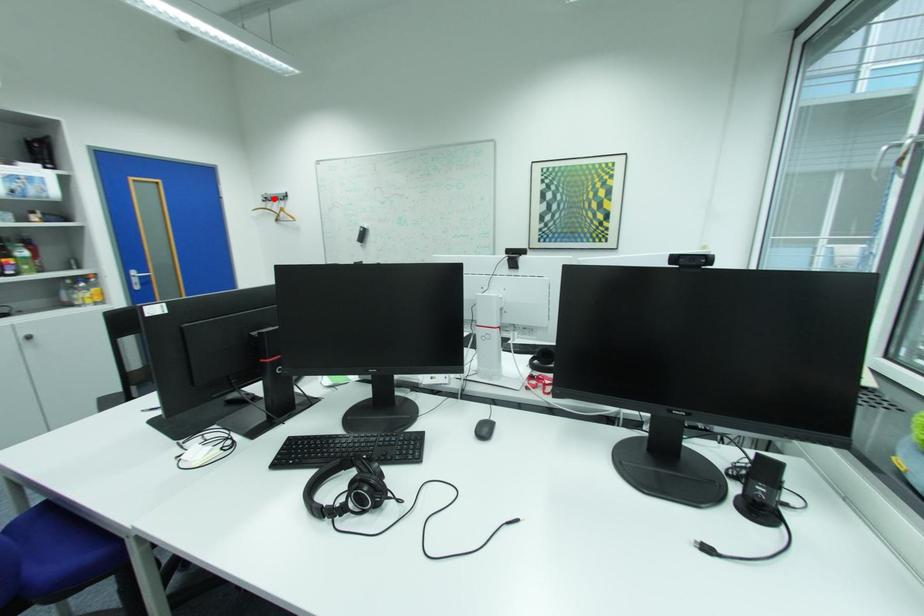
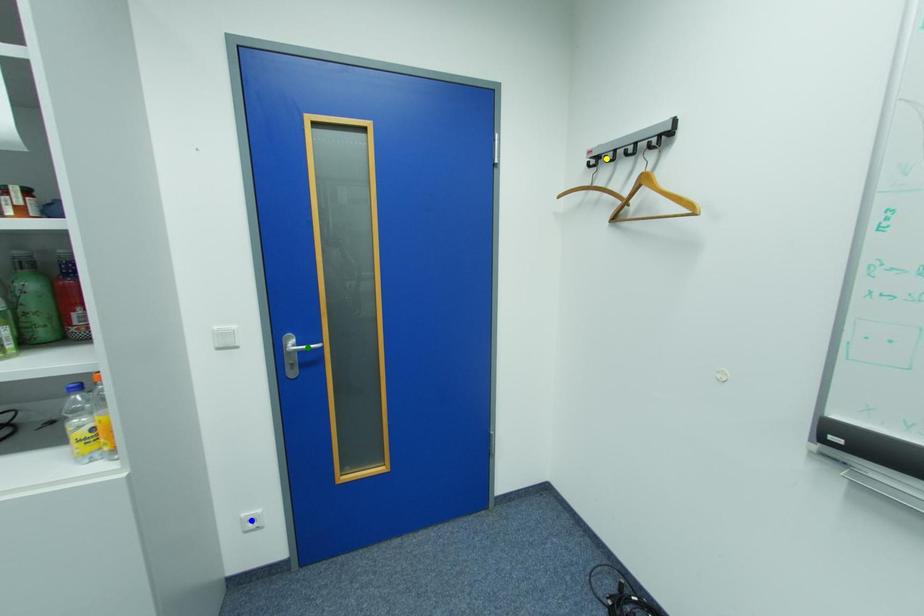
Question: I am providing you with two images of the same scene from different viewpoints. A red point is marked on the first image. You are given multiple points on the second image. Which point in image 2 represents the same 3d spot as the red point in image 1?

Choices:
 (A) yellow point
 (B) green point
 (C) blue point

Answer: (A)